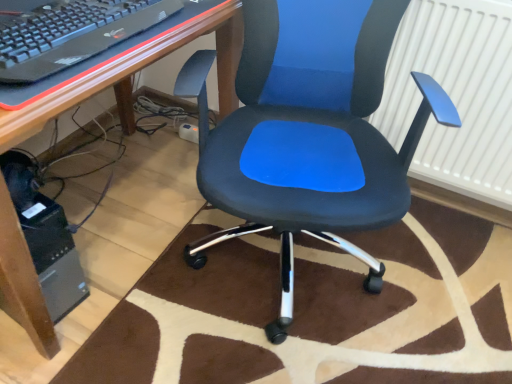
Question: From a real-world perspective, is matte black desk at center positioned above or below black plastic computer tower at lower left?

Choices:
 (A) below
 (B) above

Answer: (B)

Question: From the image's perspective, is matte black desk at center positioned above or below black plastic computer tower at lower left?

Choices:
 (A) below
 (B) above

Answer: (B)

Question: Which of these objects is positioned closest to the black plastic keyboard at upper left?

Choices:
 (A) matte black office chair at center
 (B) brown plush rug at center
 (C) white textured radiator at upper right
 (D) black plastic keyboard at upper left
 (E) matte black desk at center

Answer: (D)

Question: Considering the real-world distances, which object is farthest from the matte black office chair at center?

Choices:
 (A) black plastic computer tower at lower left
 (B) matte black desk at center
 (C) black plastic keyboard at upper left
 (D) white textured radiator at upper right
 (E) black plastic keyboard at upper left

Answer: (A)